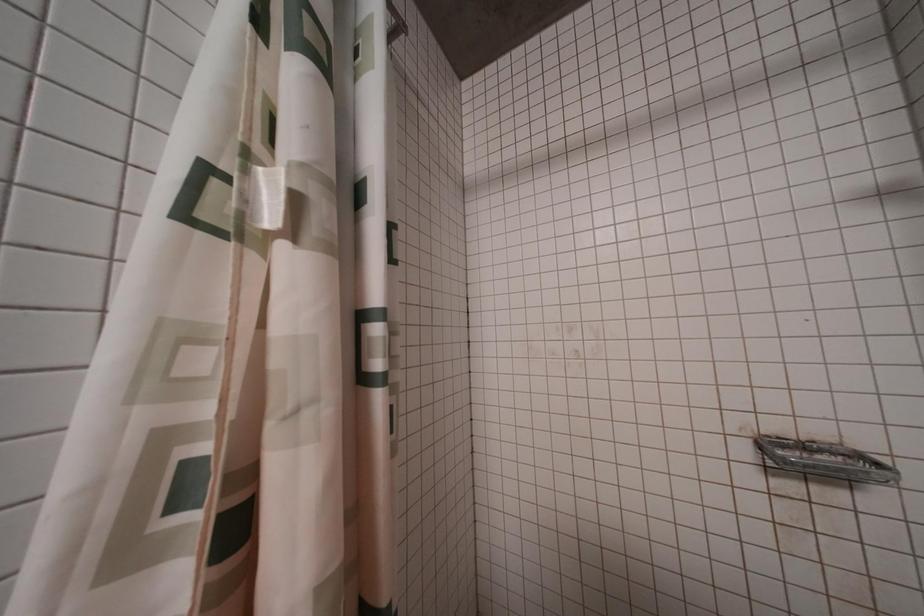
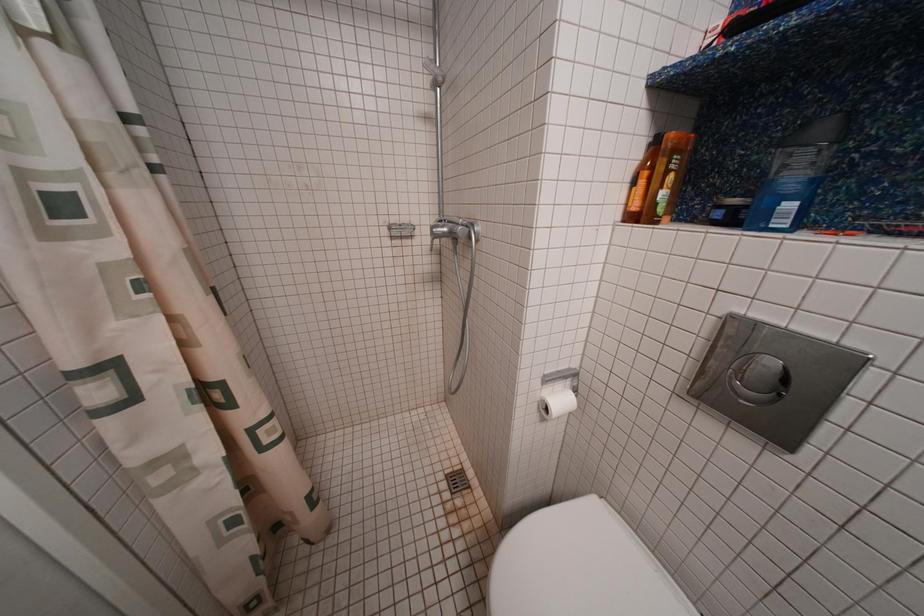
The first image is from the beginning of the video and the second image is from the end. How did the camera likely rotate when shooting the video?

The camera rotated toward right-down.